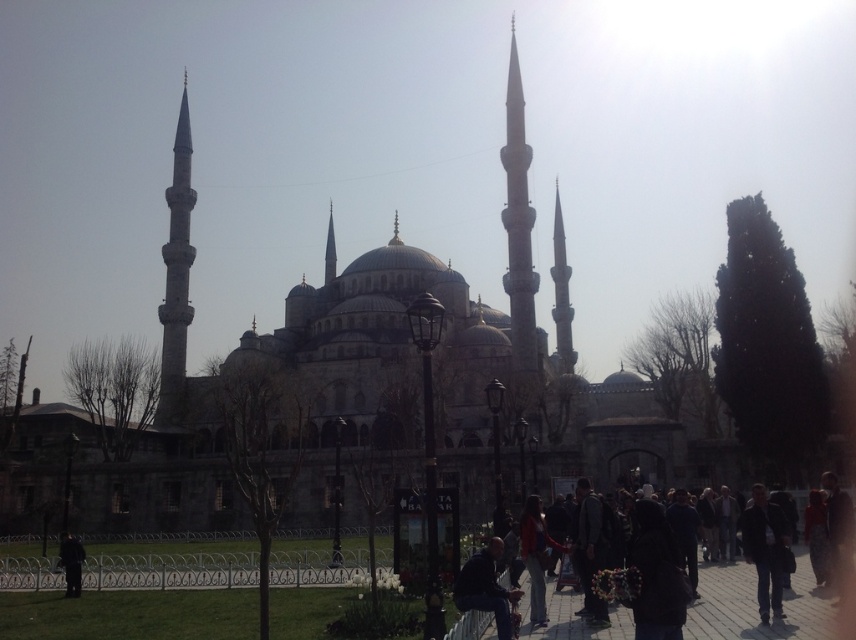
Question: Based on their relative distances, which object is nearer to the dark red jacket at lower center?

Choices:
 (A) black fabric coat at lower left
 (B) dark blue jeans at lower center
 (C) smooth stone minaret at left

Answer: (B)

Question: Among these points, which one is farthest from the camera?

Choices:
 (A) click(58, 564)
 (B) click(765, 561)
 (C) click(611, 618)

Answer: (A)

Question: Which object appears closest to the camera in this image?

Choices:
 (A) dark blue jacket at center
 (B) dark red jacket at lower center
 (C) black fabric coat at lower left
 (D) dark blue jeans at lower center

Answer: (B)

Question: Can you confirm if dark blue jeans at lower center is positioned to the left of black fabric coat at lower left?

Choices:
 (A) no
 (B) yes

Answer: (A)

Question: Does dark blue jacket at center appear on the left side of dark blue jeans at lower center?

Choices:
 (A) yes
 (B) no

Answer: (B)

Question: Does smooth stone minaret at left have a larger size compared to dark blue jacket at center?

Choices:
 (A) yes
 (B) no

Answer: (A)